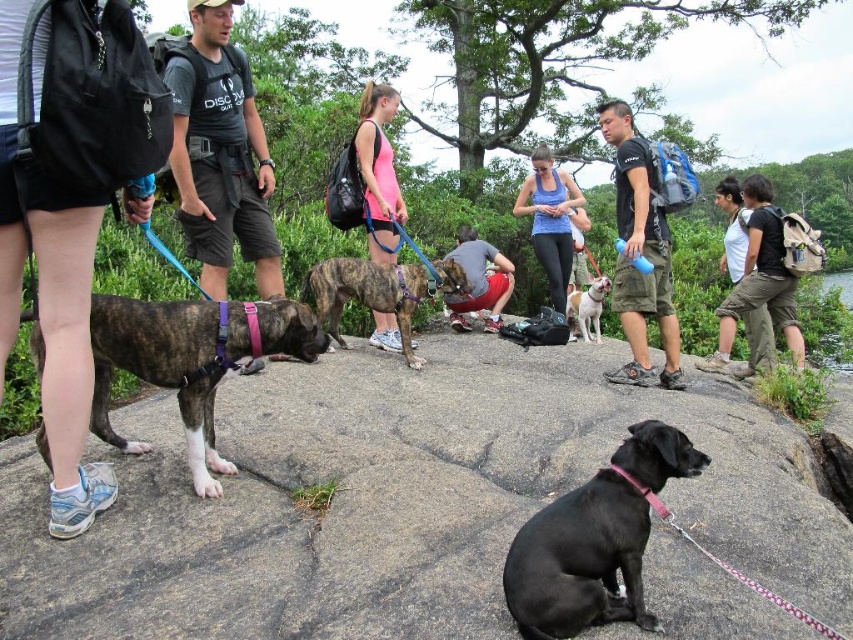
Looking at this image, is black matte shirt at center to the left of blue fabric tank top at center from the viewer's perspective?

In fact, black matte shirt at center is to the right of blue fabric tank top at center.

Which of these two, black matte shirt at center or blue fabric tank top at center, stands taller?

black matte shirt at center

Who is more distant from viewer, (x=639, y=212) or (x=561, y=234)?

The point (x=561, y=234) is behind.

This screenshot has height=640, width=853. I want to click on black matte shirt at center, so click(640, 253).

Is black matte dog at center shorter than pink fabric tank top at center?

Correct, black matte dog at center is not as tall as pink fabric tank top at center.

Between black matte dog at center and pink fabric tank top at center, which one appears on the left side from the viewer's perspective?

Positioned to the left is pink fabric tank top at center.

The image size is (853, 640). In order to click on black matte dog at center in this screenshot , I will do `click(595, 540)`.

Locate an element on the screen. The image size is (853, 640). black matte dog at center is located at coordinates tap(595, 540).

Is point (717, 614) less distant than point (543, 246)?

Yes, point (717, 614) is closer to viewer.

Does black smooth rock at center come in front of blue fabric tank top at center?

Yes, it is in front of blue fabric tank top at center.

Does point (430, 346) lie behind point (567, 259)?

No, it is not.

At what (x,y) coordinates should I click in order to perform the action: click on black smooth rock at center. Please return your answer as a coordinate pair (x, y). The width and height of the screenshot is (853, 640). Looking at the image, I should click on (396, 500).